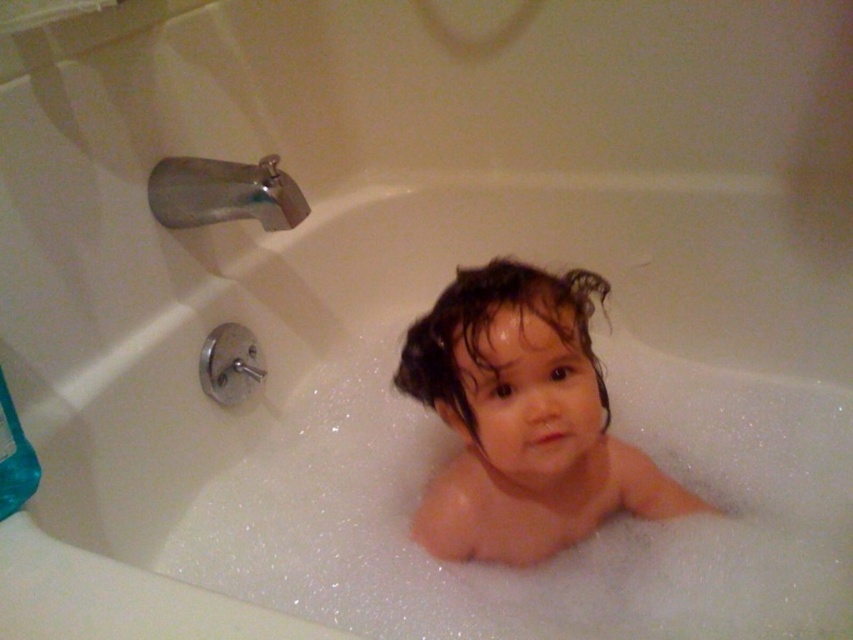
Describe the element at coordinates (521, 419) in the screenshot. Image resolution: width=853 pixels, height=640 pixels. I see `wet skin toddler at center` at that location.

Consider the image. Is wet skin toddler at center closer to the viewer compared to silver metallic faucet at upper left?

Yes, it is.

Between point (527, 337) and point (234, 195), which one is positioned in front?

Positioned in front is point (527, 337).

Where is `wet skin toddler at center`? wet skin toddler at center is located at coordinates (521, 419).